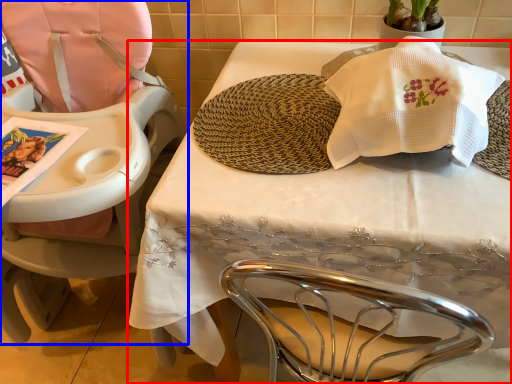
Question: Among these objects, which one is nearest to the camera, table (highlighted by a red box) or chair (highlighted by a blue box)?

Choices:
 (A) table
 (B) chair

Answer: (B)